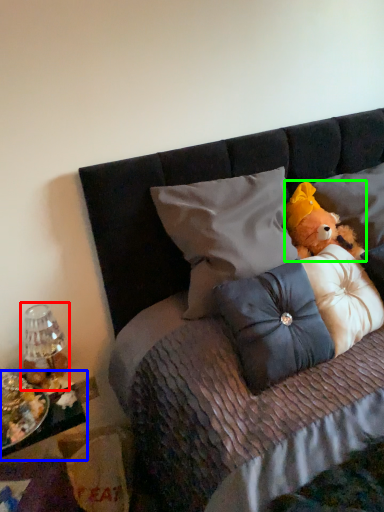
Question: Which is nearer to the lamp (highlighted by a red box)? table (highlighted by a blue box) or teddy bear (highlighted by a green box).

Choices:
 (A) table
 (B) teddy bear

Answer: (A)